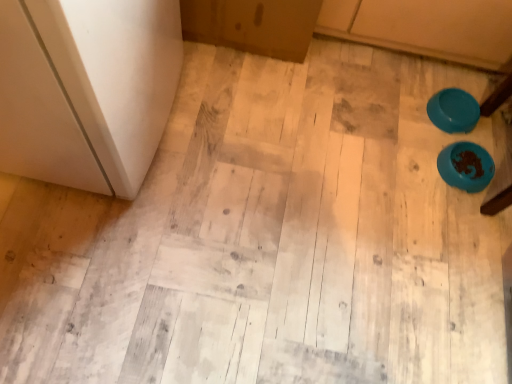
This screenshot has width=512, height=384. I want to click on vacant space that is to the left of blue plastic bowl at lower right, which appears as the second bowl when viewed from the top, so click(409, 154).